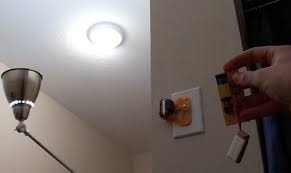
Locate an element on the screen. This screenshot has height=173, width=291. lamp is located at coordinates (21, 94).